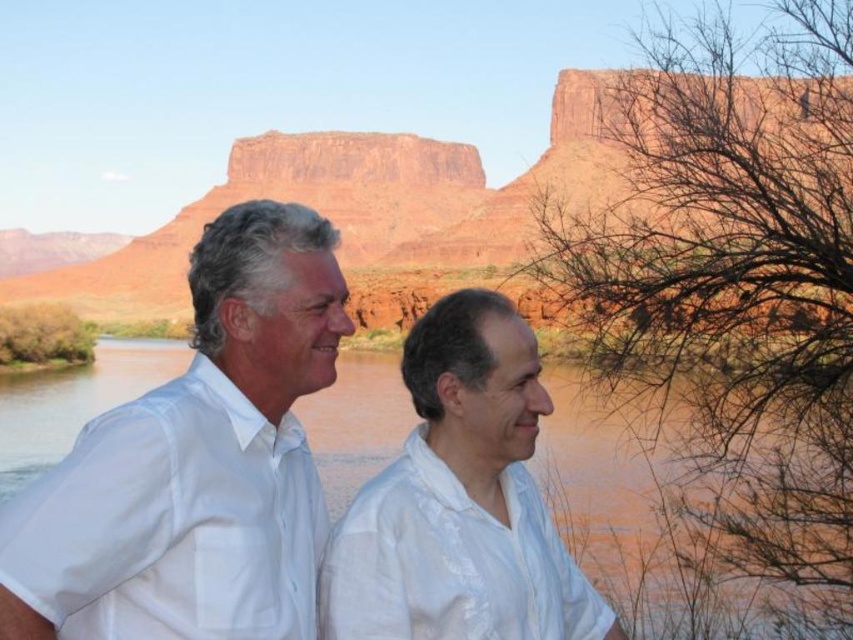
Who is higher up, brown sedimentary water at center or white cotton shirt at center?

brown sedimentary water at center is higher up.

Does brown sedimentary water at center have a greater width compared to white cotton shirt at center?

Yes, brown sedimentary water at center is wider than white cotton shirt at center.

You are a GUI agent. You are given a task and a screenshot of the screen. Output one action in this format:
    pyautogui.click(x=<x>, y=<y>)
    Task: Click on the brown sedimentary water at center
    Image resolution: width=853 pixels, height=640 pixels.
    Given the screenshot: What is the action you would take?
    pyautogui.click(x=619, y=516)

Between white cotton shirt at left and brown sedimentary water at center, which one appears on the right side from the viewer's perspective?

white cotton shirt at left

At what (x,y) coordinates should I click in order to perform the action: click on white cotton shirt at left. Please return your answer as a coordinate pair (x, y). This screenshot has width=853, height=640. Looking at the image, I should click on (196, 464).

Is white cotton shirt at left thinner than white cotton shirt at center?

Correct, white cotton shirt at left's width is less than white cotton shirt at center's.

Is point (180, 490) farther from camera compared to point (547, 556)?

No, it is not.

The image size is (853, 640). In order to click on white cotton shirt at left in this screenshot , I will do `click(196, 464)`.